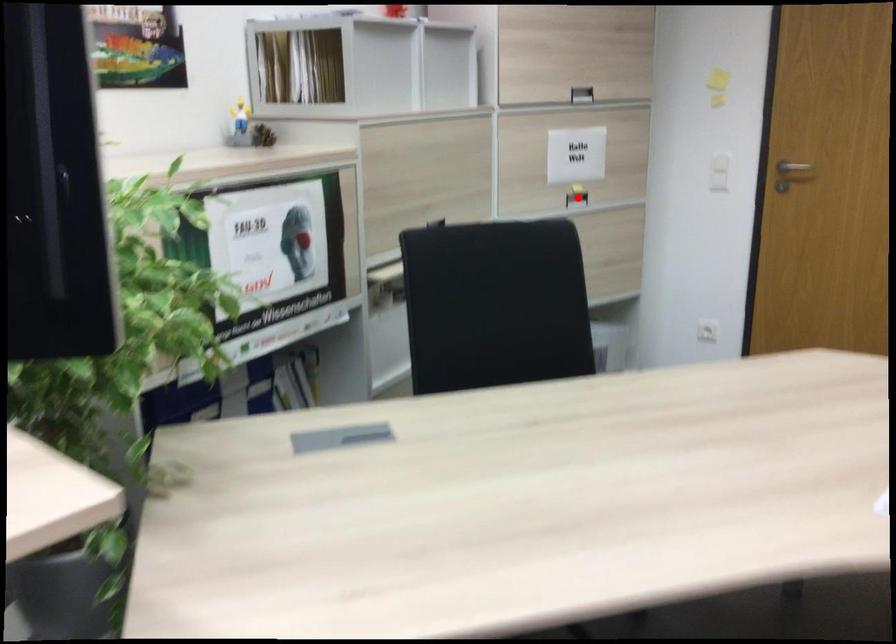
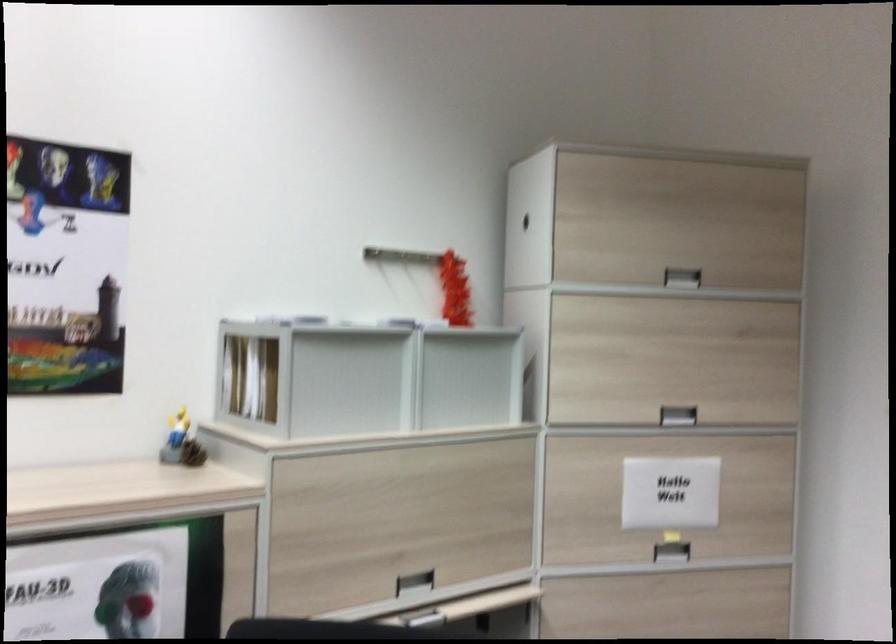
Where in the second image is the point corresponding to the highlighted location from the first image?

(670, 552)